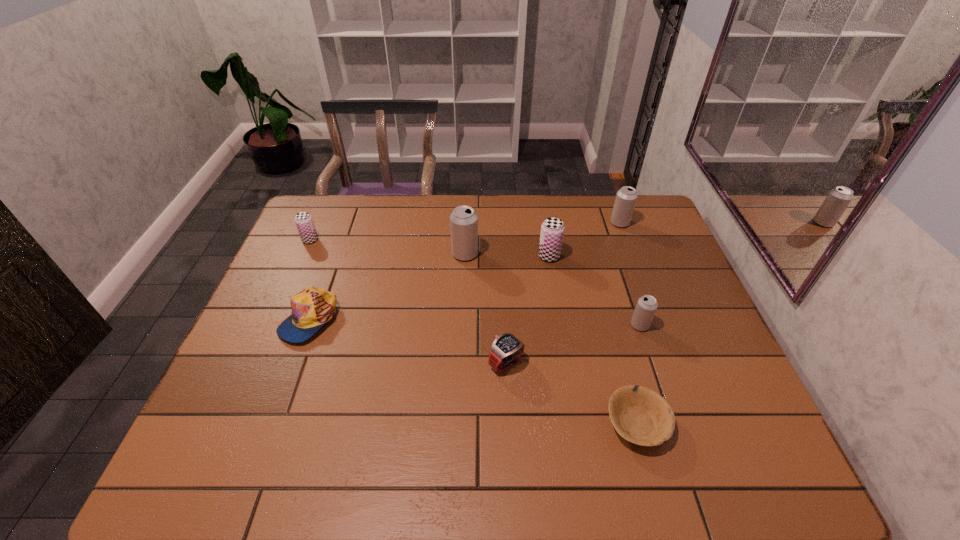
Find the location of `free location located 0.180m on the bill of the cap`. free location located 0.180m on the bill of the cap is located at coordinates (276, 410).

At what (x,y) coordinates should I click in order to perform the action: click on vacant area situated 0.280m on the left of the watch. Please return your answer as a coordinate pair (x, y). This screenshot has width=960, height=540. Looking at the image, I should click on (376, 363).

This screenshot has width=960, height=540. Identify the location of blank space located 0.340m on the left of the shortest object. (454, 423).

Identify the location of object that is at the near edge. This screenshot has width=960, height=540. (641, 416).

Where is `beer can at the left edge`? beer can at the left edge is located at coordinates (303, 220).

The image size is (960, 540). Find the location of `cap positioned at the left edge`. cap positioned at the left edge is located at coordinates (311, 308).

Find the location of a particular element. Image resolution: width=960 pixels, height=540 pixels. object situated at the far left corner is located at coordinates (303, 220).

Locate an element on the screen. Image resolution: width=960 pixels, height=540 pixels. object that is at the far right corner is located at coordinates (626, 197).

In the image, there is a desktop. Find the location of `vacant space at the far edge`. vacant space at the far edge is located at coordinates (573, 226).

At what (x,y) coordinates should I click in order to perform the action: click on free spot at the near edge of the desktop. Please return your answer as a coordinate pair (x, y). The image size is (960, 540). Looking at the image, I should click on (586, 448).